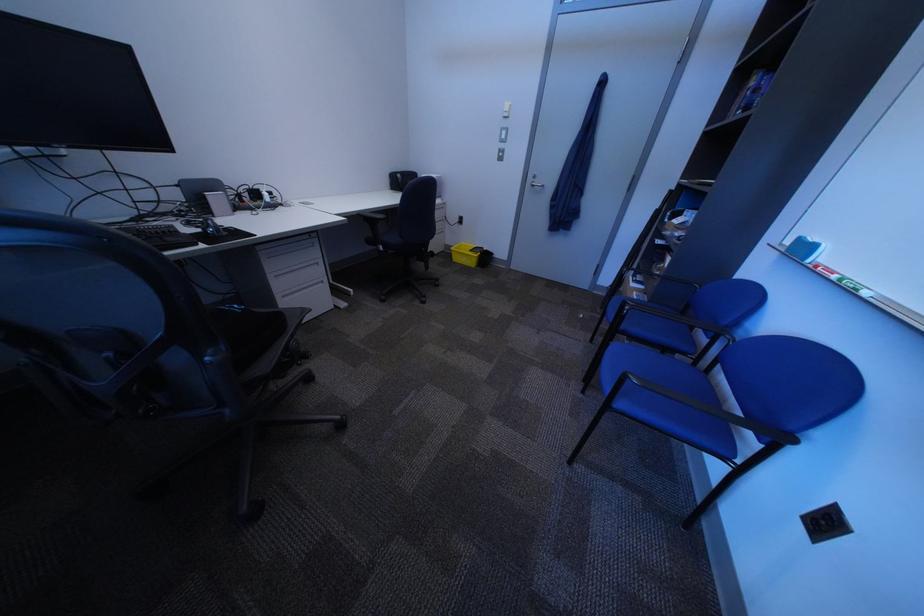
What do you see at coordinates (535, 184) in the screenshot? I see `a silver door handle` at bounding box center [535, 184].